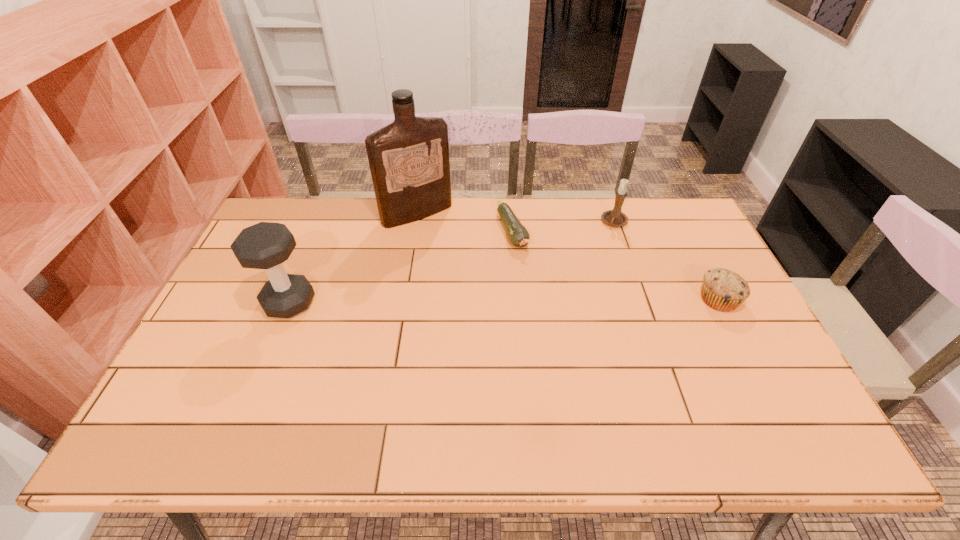
This screenshot has height=540, width=960. In order to click on free point between the zucchini and the fourth object from right to left in this screenshot , I will do `click(465, 223)`.

Identify which object is located as the nearest to the candle holder. Please provide its 2D coordinates. Your answer should be formatted as a tuple, i.e. [(x, y)], where the tuple contains the x and y coordinates of a point satisfying the conditions above.

[(518, 235)]

This screenshot has width=960, height=540. Find the location of `object that is the third closest one to the shortest object`. object that is the third closest one to the shortest object is located at coordinates (723, 290).

Where is `free space that satisfies the following two spatial constraints: 1. on the front side of the fourth object from right to left; 2. on the left side of the third object from right to left`? The height and width of the screenshot is (540, 960). free space that satisfies the following two spatial constraints: 1. on the front side of the fourth object from right to left; 2. on the left side of the third object from right to left is located at coordinates (414, 232).

Locate an element on the screen. The width and height of the screenshot is (960, 540). free space that satisfies the following two spatial constraints: 1. on the back side of the dumbbell; 2. on the left side of the shortest object is located at coordinates (318, 232).